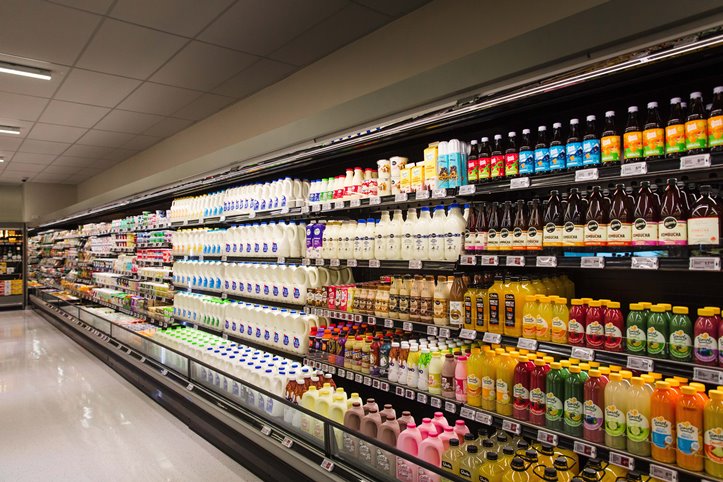
Where is `ceiling`? Image resolution: width=723 pixels, height=482 pixels. ceiling is located at coordinates (121, 83).